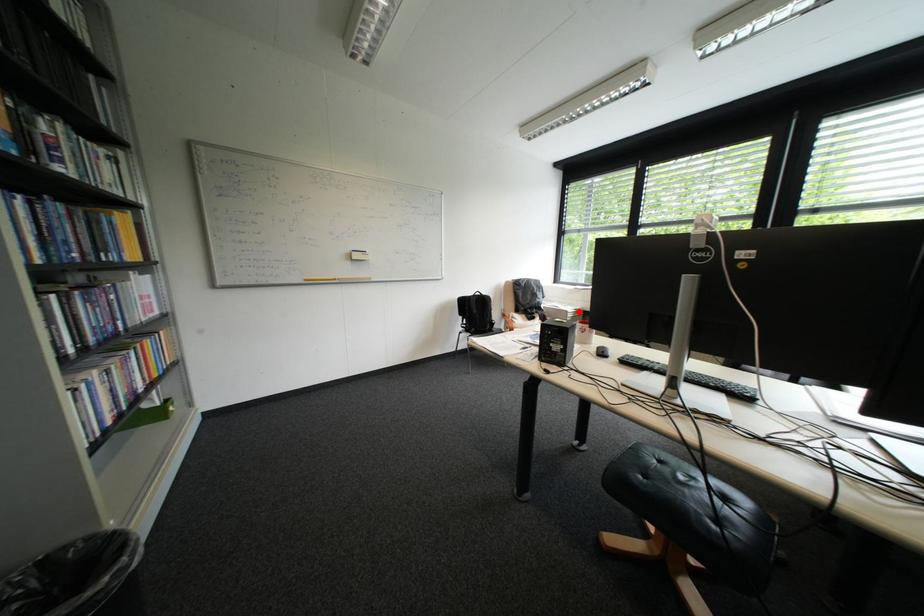
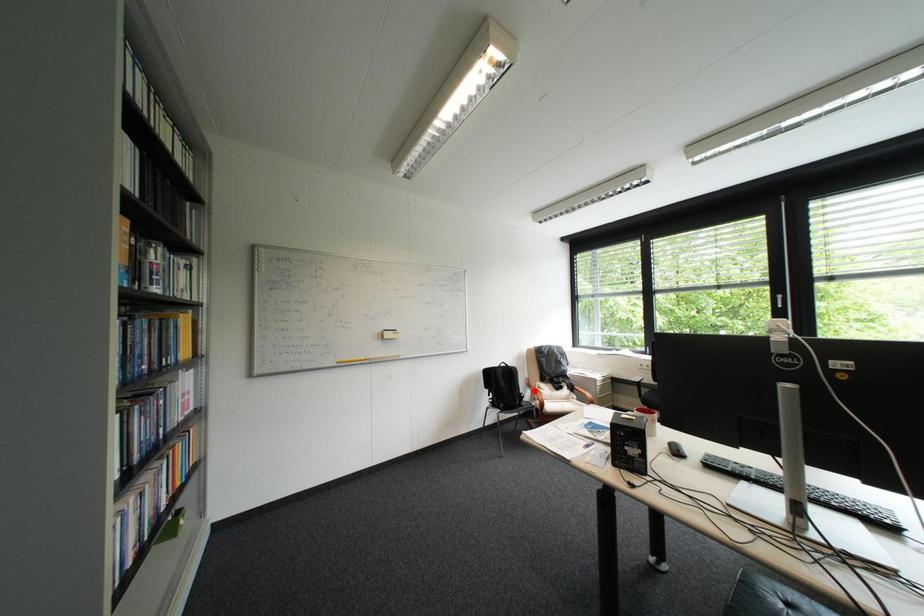
I am providing you with two images of the same scene from different viewpoints. A red point is marked on the first image and another point is marked on the second image. Do the highlighted points in image1 and image2 indicate the same real-world spot?

No